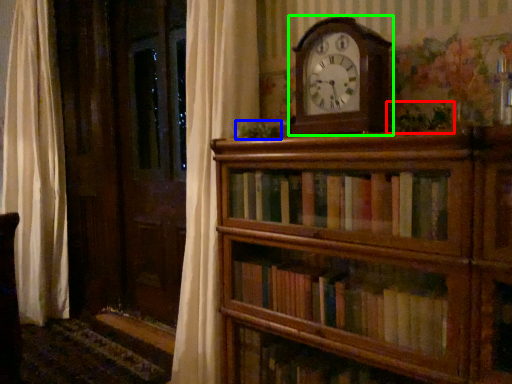
Question: Considering the real-world distances, which object is farthest from plant (highlighted by a red box)? plant (highlighted by a blue box) or wall clock (highlighted by a green box)?

Choices:
 (A) plant
 (B) wall clock

Answer: (A)